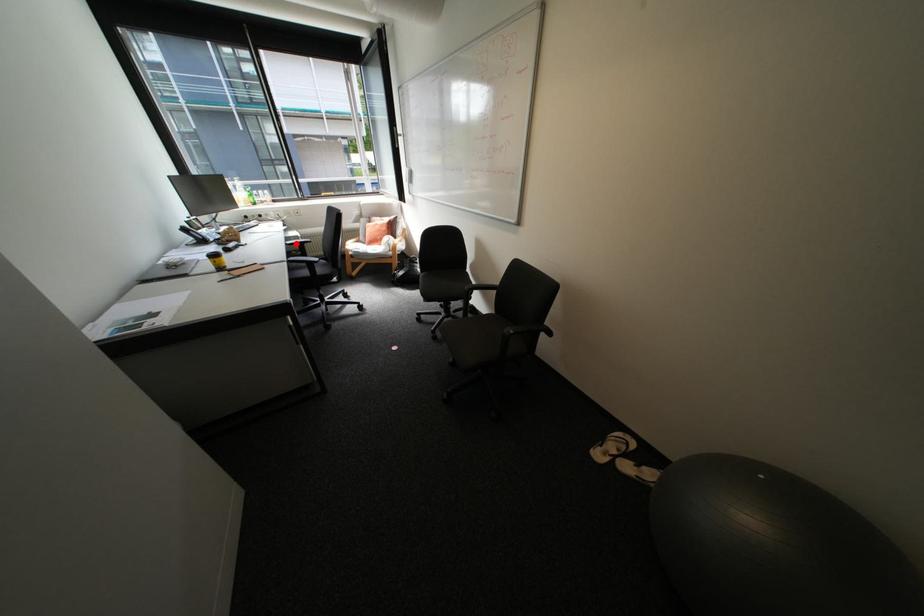
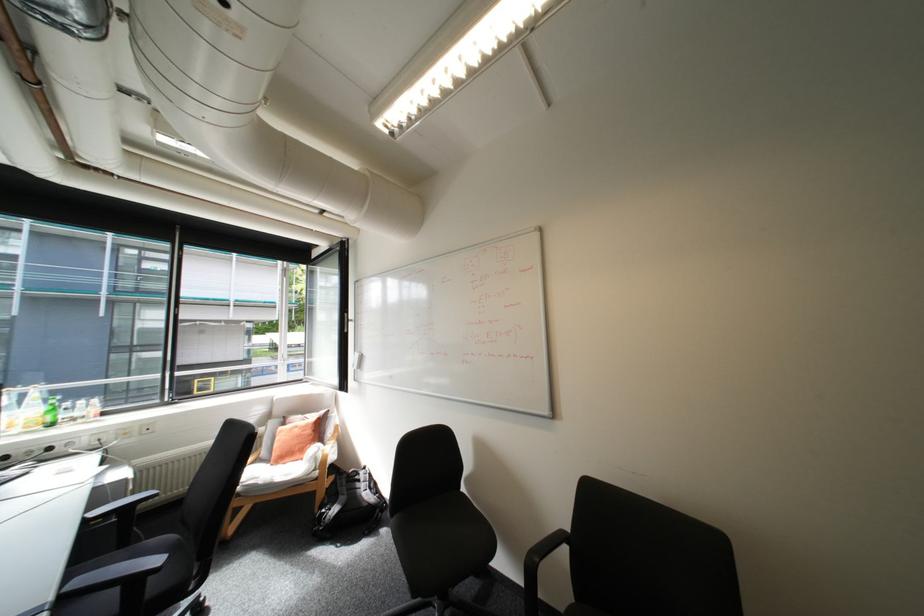
In the second image, find the point that corresponds to the highlighted location in the first image.

(94, 519)